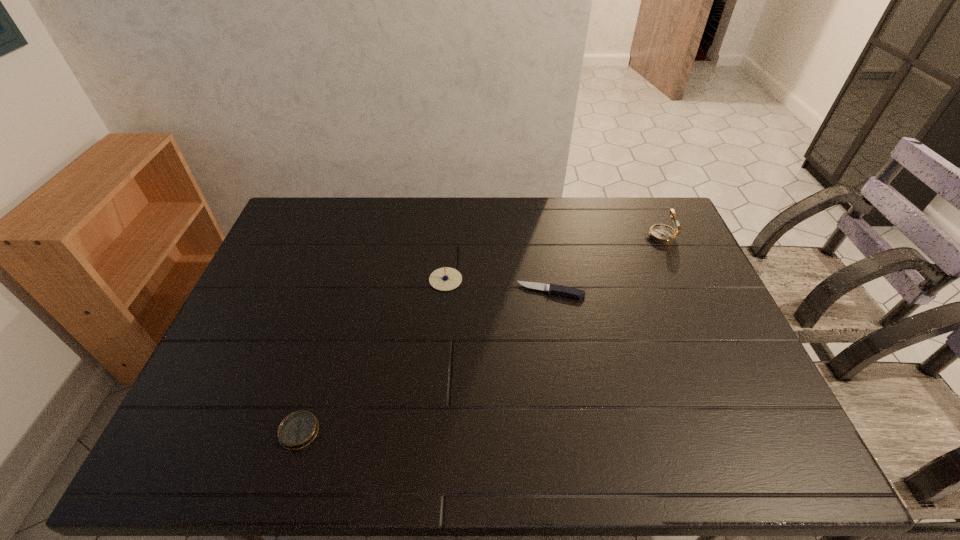
Find the location of a particular element. This screenshot has height=540, width=960. the farthest compass is located at coordinates (663, 234).

Locate an element on the screen. the tallest object is located at coordinates (663, 234).

What are the coordinates of `the second nearest compass` in the screenshot? It's located at (444, 279).

This screenshot has height=540, width=960. I want to click on the second object from left to right, so click(444, 279).

Locate an element on the screen. This screenshot has width=960, height=540. the third object from left to right is located at coordinates (561, 290).

The width and height of the screenshot is (960, 540). I want to click on the shortest compass, so coord(297,430).

In order to click on the leftmost object in this screenshot , I will do `click(297, 430)`.

You are a GUI agent. You are given a task and a screenshot of the screen. Output one action in this format:
    pyautogui.click(x=<x>, y=<y>)
    Task: Click on the vacant area situated with the dial facing the rightmost object
    This screenshot has width=960, height=540.
    Given the screenshot: What is the action you would take?
    pyautogui.click(x=551, y=237)

The image size is (960, 540). I want to click on vacant space situated with the dial facing the rightmost object, so 588,237.

Locate an element on the screen. The image size is (960, 540). blank space located 0.400m with the dial facing the rightmost object is located at coordinates (528, 237).